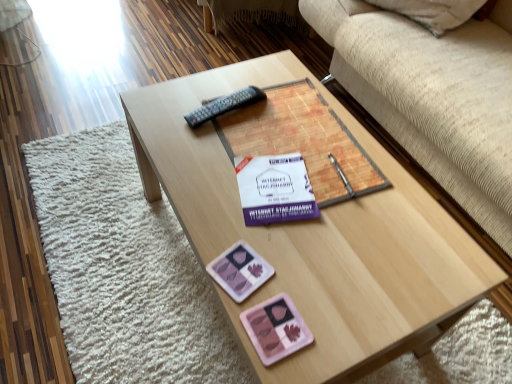
Where is `free space to the right of pink plastic at lower center, which appears as the 1th currency when viewed from the top`? free space to the right of pink plastic at lower center, which appears as the 1th currency when viewed from the top is located at coordinates (320, 280).